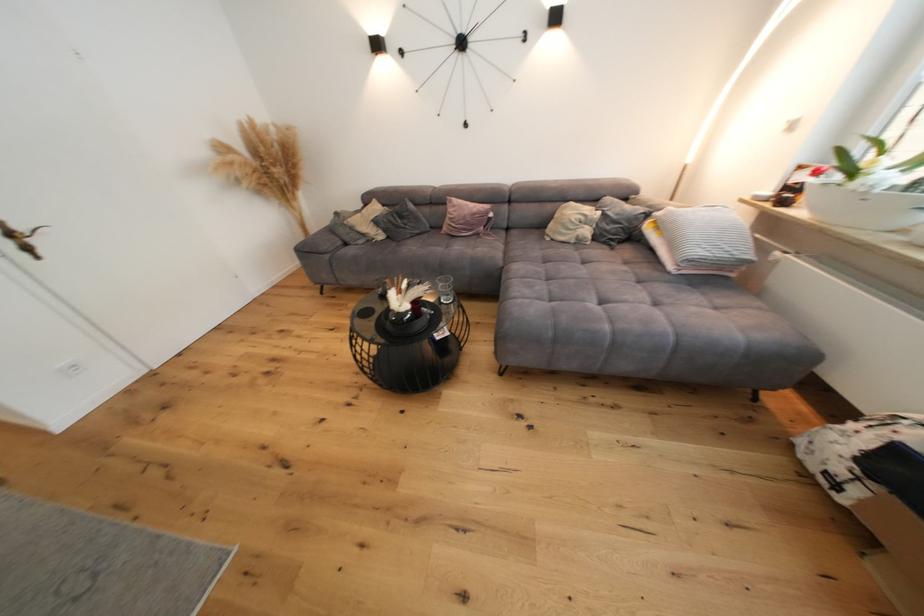
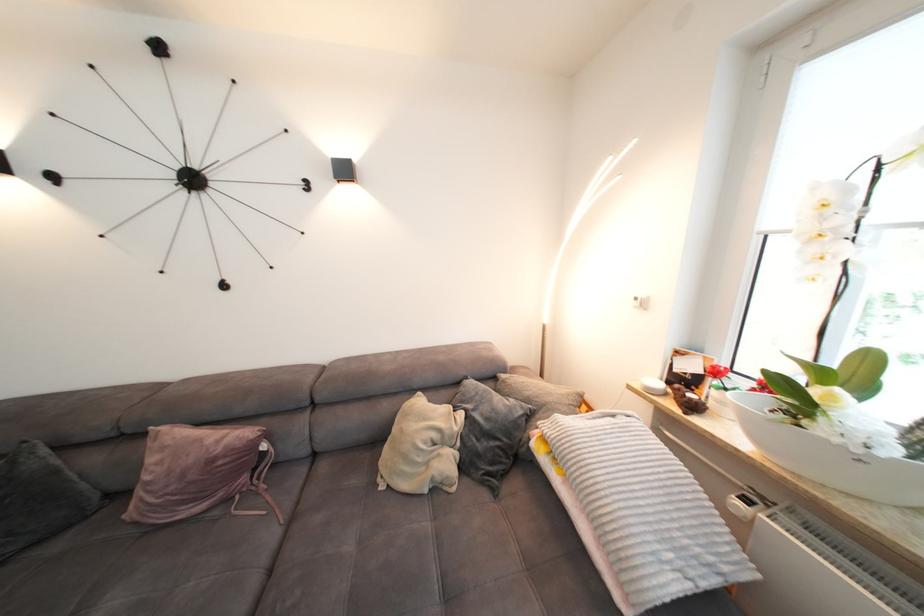
Locate, in the second image, the point that corresponds to pixel 793 129 in the first image.

(643, 305)